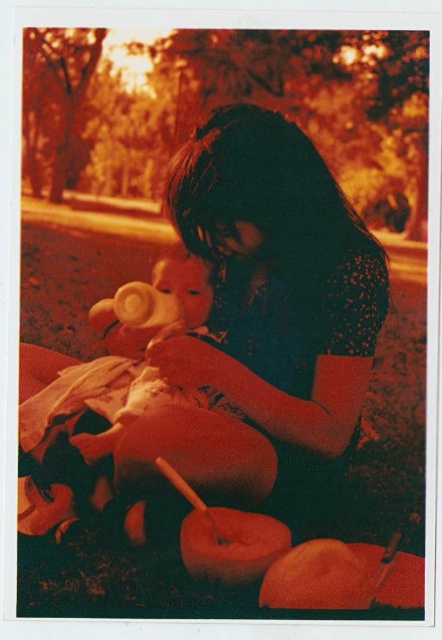
You are a photographer analyzing this vintage image. You notice the matte black dress at center and the smooth beige bottle at left. Which object appears larger in the photo?

The matte black dress at center appears larger than the smooth beige bottle at left because it is much taller.

Based on the scene description, where is the matte black dress at center located in terms of its 2D coordinates?

The matte black dress at center is located at the 2D coordinates of point (229, 339).

Based on the scene description provided, what object is located at the coordinates point (229, 339)?

The object located at point (229, 339) is the matte black dress at center.